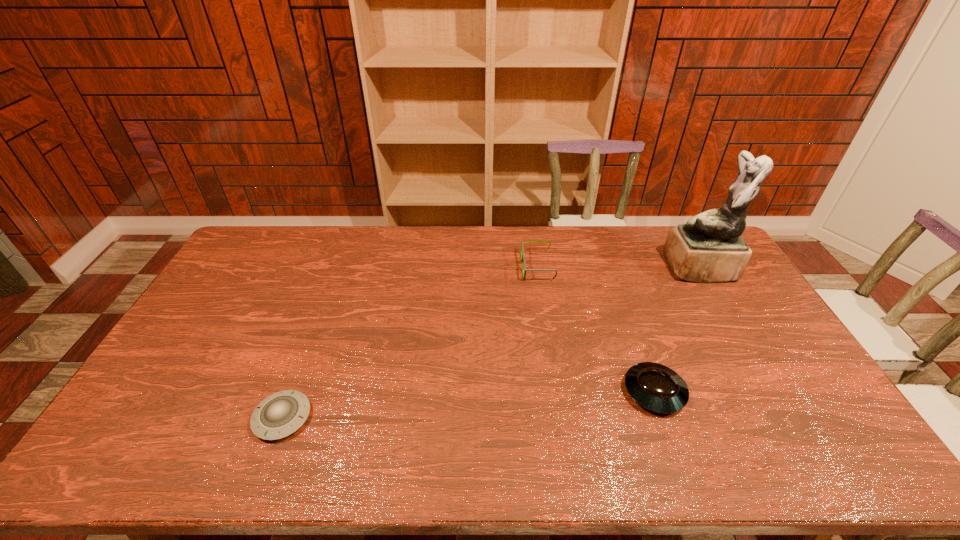
The width and height of the screenshot is (960, 540). I want to click on blank area located on the lens of the spectacles, so click(464, 267).

Locate an element on the screen. Image resolution: width=960 pixels, height=540 pixels. vacant space situated 0.110m on the lens of the spectacles is located at coordinates (492, 267).

The height and width of the screenshot is (540, 960). I want to click on free space located 0.370m on the lens of the spectacles, so click(x=420, y=267).

The image size is (960, 540). Find the location of `vacant space situated on the left of the right saucer`. vacant space situated on the left of the right saucer is located at coordinates pos(572,392).

Where is `vacant region located 0.110m on the right of the leftmost object`? This screenshot has width=960, height=540. vacant region located 0.110m on the right of the leftmost object is located at coordinates (353, 417).

You are a GUI agent. You are given a task and a screenshot of the screen. Output one action in this format:
    pyautogui.click(x=<x>, y=<y>)
    Task: Click on the sculpture that is at the far edge
    The image size is (960, 540).
    Given the screenshot: What is the action you would take?
    pyautogui.click(x=709, y=248)

The height and width of the screenshot is (540, 960). What are the coordinates of `spectacles at the far edge` in the screenshot? It's located at (522, 247).

This screenshot has height=540, width=960. I want to click on object that is at the near edge, so click(279, 415).

Locate an element on the screen. The image size is (960, 540). object that is at the right edge is located at coordinates (709, 248).

I want to click on object that is at the far right corner, so pyautogui.click(x=709, y=248).